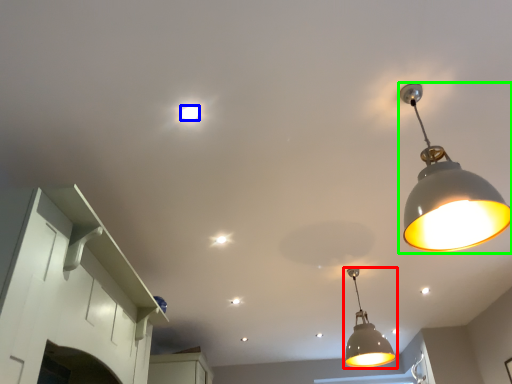
Question: Which object is the farthest from lamp (highlighted by a red box)? Choose among these: light bulb (highlighted by a blue box) or lamp (highlighted by a green box).

Choices:
 (A) light bulb
 (B) lamp

Answer: (A)